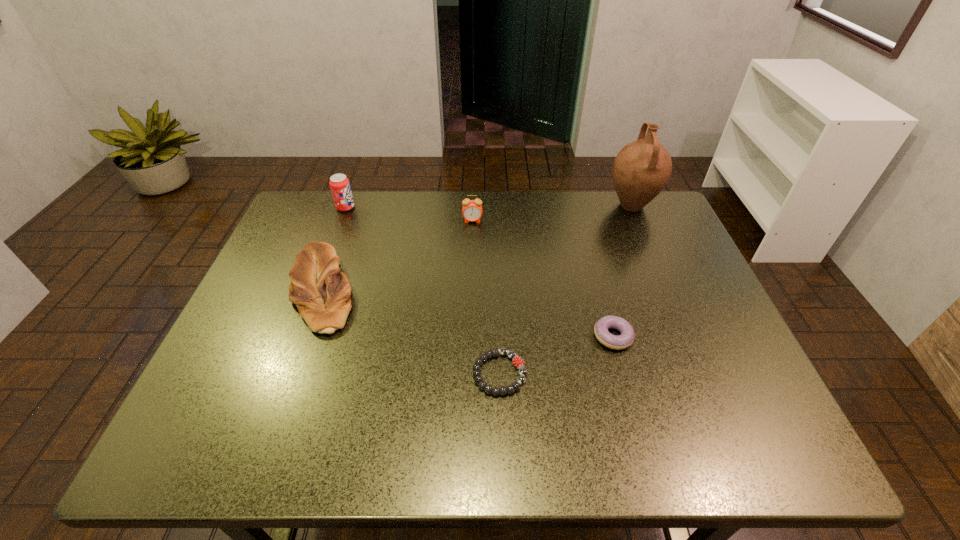
Find the location of a particular element. The image size is (960, 540). vacant space that satisfies the following two spatial constraints: 1. on the face of the alarm clock; 2. on the left side of the shortest object is located at coordinates (469, 373).

I want to click on free location that satisfies the following two spatial constraints: 1. on the surface of the second object from right to left; 2. on the left side of the soda can, so click(297, 336).

This screenshot has height=540, width=960. In order to click on vacant area that satisfies the following two spatial constraints: 1. on the surface of the second object from right to left; 2. on the right side of the soda can in this screenshot , I will do `click(297, 336)`.

The width and height of the screenshot is (960, 540). What are the coordinates of `free space that satisfies the following two spatial constraints: 1. on the surface of the second tallest object; 2. on the left side of the shortest object` in the screenshot? It's located at (283, 373).